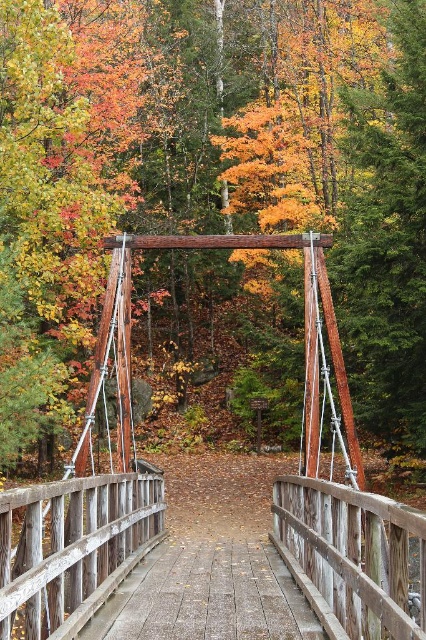
Consider the image. You are planning to cross the wooden bridge at center while carrying a large backpack. There is a wooden swing at center nearby. Which one do you think has a wider structure to support your weight?

The wooden swing at center might be wider than wooden bridge at center, so it could provide better support for carrying a large backpack.

You are a hiker who wants to cross the wooden bridge at center. You see a wooden swing at center nearby. Which object is larger in size?

The wooden swing at center is bigger than the wooden bridge at center.

You are standing on the wooden suspension bridge in the autumn forest. You notice two points marked on the bridge deck. The first point is at coordinates point (210, 221), and the second is at point (310, 611). Which point is closer to you as you stand on the bridge?

Point (210, 221) is further to the camera than point (310, 611), so the point closer to you is point (310, 611).